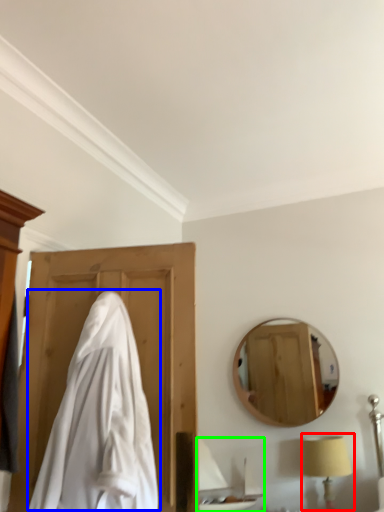
Question: Considering the real-world distances, which object is farthest from table lamp (highlighted by a red box)? cloak (highlighted by a blue box) or sink (highlighted by a green box)?

Choices:
 (A) cloak
 (B) sink

Answer: (A)